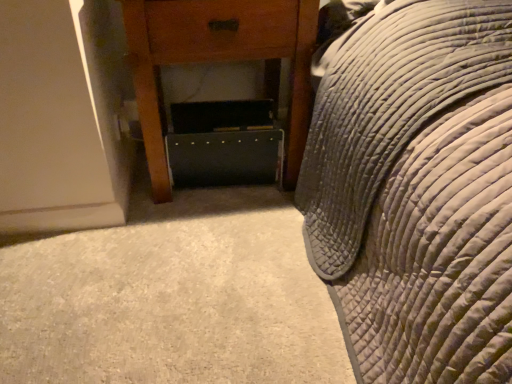
The image size is (512, 384). What are the coordinates of `wooden nightstand at center` in the screenshot? It's located at (218, 60).

What do you see at coordinates (218, 60) in the screenshot? Image resolution: width=512 pixels, height=384 pixels. I see `wooden nightstand at center` at bounding box center [218, 60].

What are the coordinates of `wooden nightstand at center` in the screenshot? It's located at (218, 60).